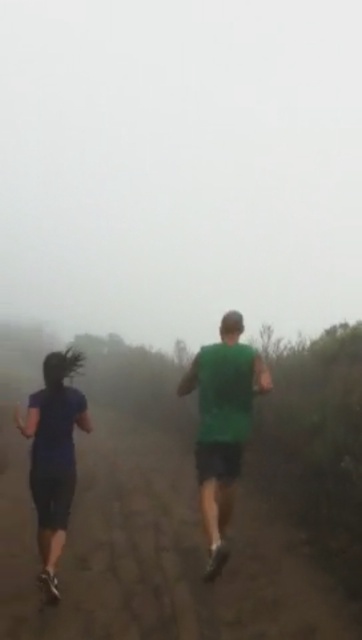
You are standing at the point marked as point (257,358) in the image. You want to walk towards the person on the right who is wearing a green sleeveless top and black shorts. Given the foggy environment, can you estimate how far you are from the viewer?

The point (257,358) is 16.75 feet away from the viewer, so you are 16.75 feet away from the viewer.

You are a runner on the dirt path in the foggy environment. You see two points marked on the path ahead of you. The first point is at coordinates point (x=246, y=433) and the second point is at point (x=36, y=404). Which point is closer to you as you face forward?

Point (x=36, y=404) is closer to you because point (x=246, y=433) is behind it.

You are a photographer trying to capture a clear shot of the two runners. The green matte tank top at center and dark blue fabric at left are the focus. Since the fog is thick, you need to adjust your camera to focus on the closest object. Which runner should you focus on?

The green matte tank top at center is to the right of dark blue fabric at left, so the dark blue fabric at left is closer to you. Focus on the dark blue fabric at left.